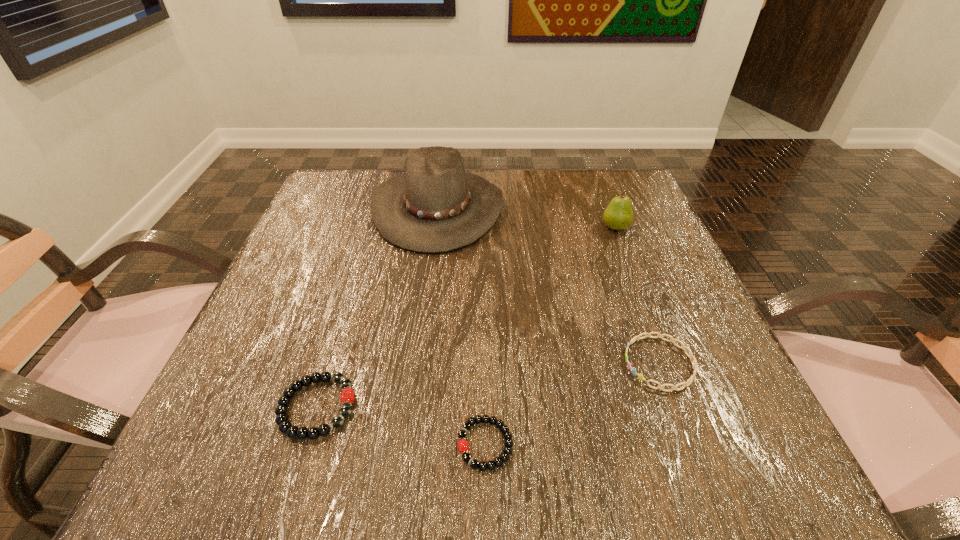
I want to click on object present at the far left corner, so click(x=436, y=207).

At what (x,y) coordinates should I click in order to perform the action: click on object present at the near left corner. Please return your answer as a coordinate pair (x, y). The image size is (960, 540). Looking at the image, I should click on (285, 426).

The image size is (960, 540). Identify the location of object present at the far right corner. point(618,215).

In the image, there is a desktop. Where is `blank space at the far edge`? The width and height of the screenshot is (960, 540). blank space at the far edge is located at coordinates (566, 181).

The height and width of the screenshot is (540, 960). Identify the location of blank area at the left edge. pos(313,318).

Identify the location of vacant position at the right edge of the desktop. The width and height of the screenshot is (960, 540). (693, 334).

Image resolution: width=960 pixels, height=540 pixels. I want to click on vacant region at the far left corner, so click(365, 187).

At what (x,y) coordinates should I click in order to perform the action: click on free space at the near left corner of the desktop. Please return your answer as a coordinate pair (x, y). This screenshot has width=960, height=540. Looking at the image, I should click on (254, 474).

Locate an element on the screen. vacant space at the far right corner of the desktop is located at coordinates (638, 187).

Identify the location of vacant space that is in between the tallest object and the rightmost bracelet. The height and width of the screenshot is (540, 960). (549, 286).